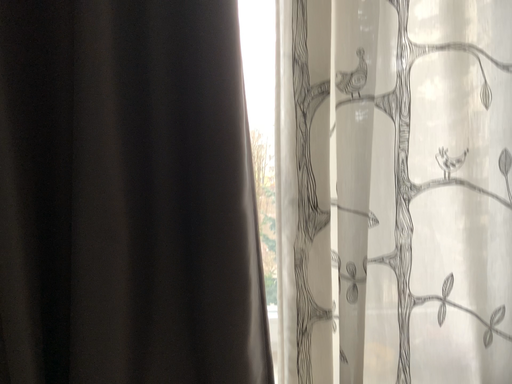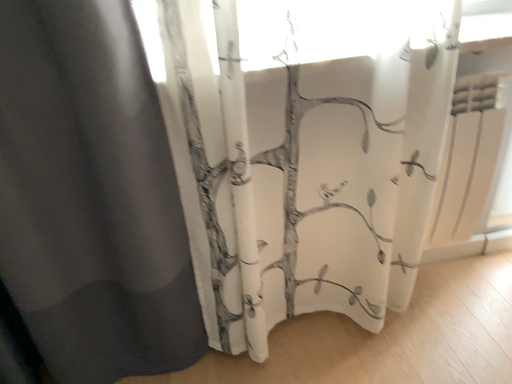
Question: Which way did the camera rotate in the video?

Choices:
 (A) rotated downward
 (B) rotated upward

Answer: (A)